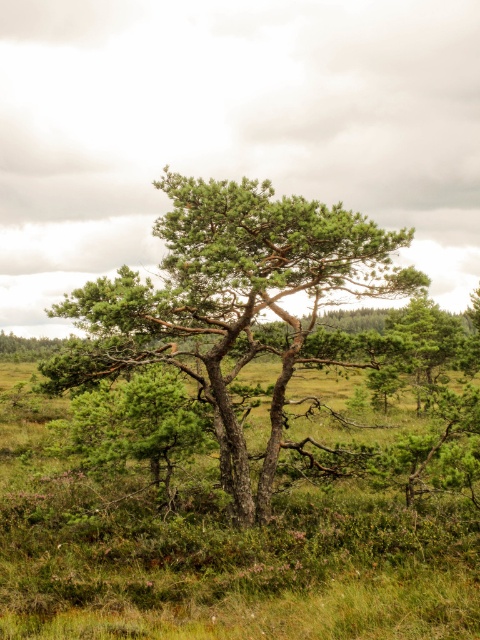
You are standing at the origin point in the landscape. Which direction should you move to reach the green textured tree at center?

The green textured tree at center is located at point coordinates of 0.477 on the x and 0.481 on the y. Since you are at the origin point, you should move towards the positive x and y directions to reach it.

You are standing at the base of the green textured tree at center and want to place a 10 meter long fence that extends straight from the tree. Will the fence reach beyond the visible landscape?

The fence is 10 meters long, and the distance to the edge of the visible landscape from the green textured tree at center is 8.64 meters. Therefore, the fence will extend beyond the visible landscape.

Based on the photo, you are standing in the natural landscape and want to touch the closest tree. Which tree should you approach, the green textured tree at center or the green matte tree at center?

You should approach the green textured tree at center because it is closer to the viewer than the green matte tree at center.